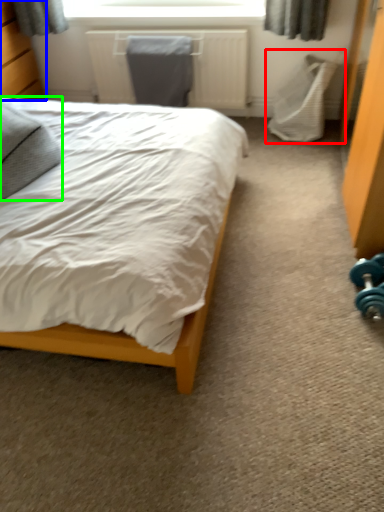
Question: Based on their relative distances, which object is farther from swivel chair (highlighted by a red box)? Choose from dresser (highlighted by a blue box) and pillow (highlighted by a green box).

Choices:
 (A) dresser
 (B) pillow

Answer: (A)